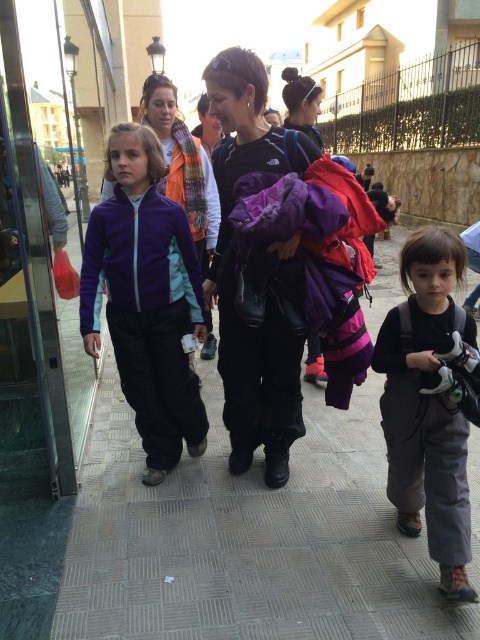
Please provide the 2D coordinates of the gray fabric backpack at lower right in the image. The answer should be in the format of coordinates in parentheses, like this example format for a coordinate point at 0.5,0.5 would be written as follows in the answer box. Answer with the exact numerical values given in the Objects Description. Do not add any extra text or explanations. Answer only the coordinates in the format specified.

The gray fabric backpack at lower right is located at coordinates point (428, 404).

You are a delivery person trying to walk through the sidewalk shown in the image. You need to avoid stepping on the gray tile pavement at center. Which direction should you move relative to the matte black jacket at center?

The gray tile pavement at center is positioned on the left side of the matte black jacket at center. To avoid stepping on the gray tile pavement at center, you should move to the right side of the matte black jacket at center.